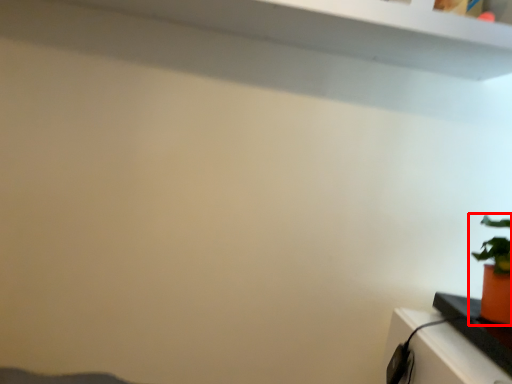
Question: Observing the image, what is the correct spatial positioning of houseplant (annotated by the red box) in reference to table?

Choices:
 (A) right
 (B) left

Answer: (A)